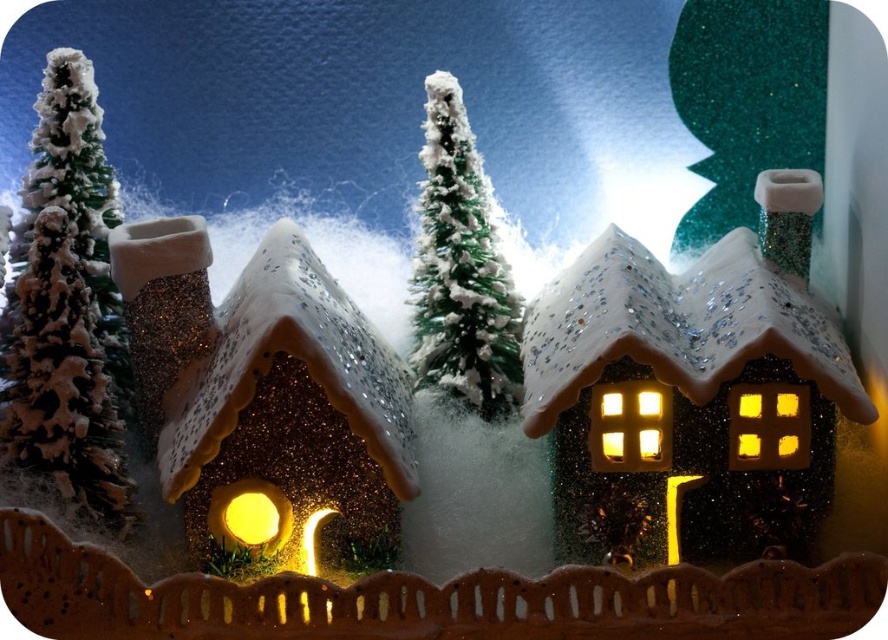
You are setting up a holiday display and need to place the green glittery tree at left and the green frosted tree at center in a specific order. Based on their sizes, which tree should you place first if you want the larger one to be more prominent in the display?

The green glittery tree at left is larger in size than the green frosted tree at center, so you should place the green glittery tree at left first to make it more prominent in the display.

In the winter scene, there are two houses with lit windows. The left house has a circular window at ground level. Can you tell me what object is located at the coordinate point (66, 305)?

The point (66, 305) marks the green glittery tree at left.

You are setting up a holiday display and want to place a decorative snowman between the green glittery tree at left and the green frosted tree at center. Based on their widths, which tree should the snowman be closer to?

The green glittery tree at left might be wider than the green frosted tree at center, so the snowman should be placed closer to the green glittery tree at left to ensure adequate space around it.